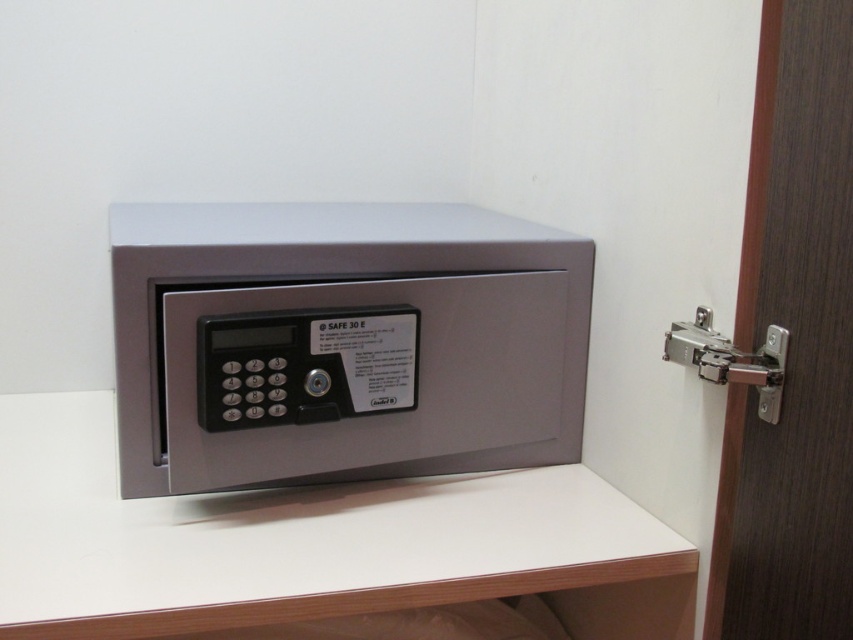
Question: Can you confirm if satin metallic safe at center is positioned to the right of dark brown wood door at right?

Choices:
 (A) no
 (B) yes

Answer: (A)

Question: Which of the following is the farthest from the observer?

Choices:
 (A) satin metallic safe at center
 (B) silver metallic hinge at right
 (C) dark brown wood door at right

Answer: (A)

Question: Which object is the closest to the satin metallic safe at center?

Choices:
 (A) dark brown wood door at right
 (B) silver metallic hinge at right

Answer: (B)

Question: Does satin metallic safe at center have a lesser width compared to dark brown wood door at right?

Choices:
 (A) no
 (B) yes

Answer: (A)

Question: Among these objects, which one is farthest from the camera?

Choices:
 (A) silver metallic hinge at right
 (B) dark brown wood door at right
 (C) satin metallic safe at center

Answer: (C)

Question: Can you confirm if satin metallic safe at center is smaller than dark brown wood door at right?

Choices:
 (A) yes
 (B) no

Answer: (B)